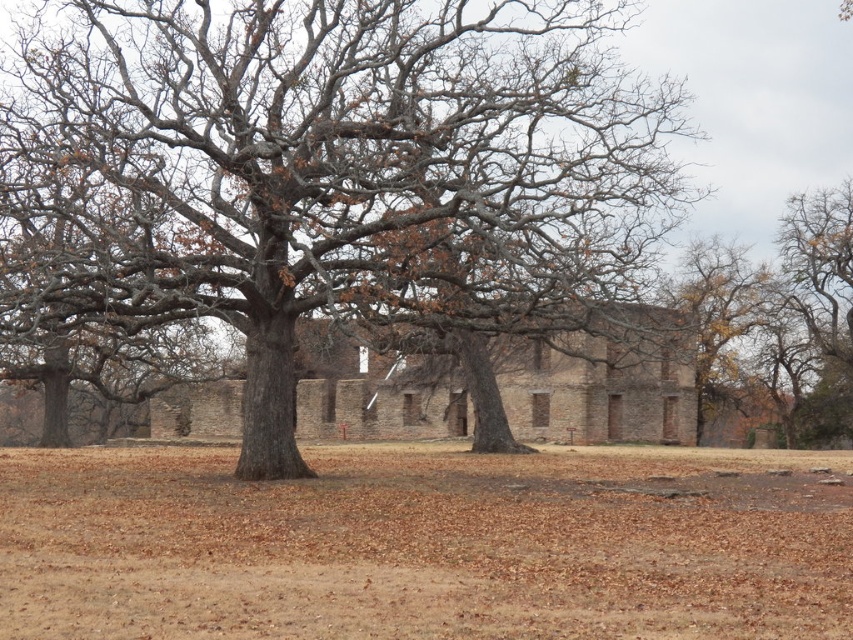
Question: Among these objects, which one is nearest to the camera?

Choices:
 (A) brown rough bark tree at center
 (B) yellow-green leaves at center

Answer: (A)

Question: Can you confirm if brown dry grass at center is smaller than yellow-green leaves at center?

Choices:
 (A) yes
 (B) no

Answer: (B)

Question: Which object appears closest to the camera in this image?

Choices:
 (A) yellow-green leaves at center
 (B) brown dry grass at center
 (C) brown rough bark tree at center

Answer: (B)

Question: Can you confirm if brown rough bark tree at center is bigger than brown dry grass at center?

Choices:
 (A) no
 (B) yes

Answer: (B)

Question: Can you confirm if brown rough bark tree at center is wider than brown dry grass at center?

Choices:
 (A) no
 (B) yes

Answer: (A)

Question: Which point is farther from the camera taking this photo?

Choices:
 (A) (294, 141)
 (B) (312, 522)
 (C) (705, 240)

Answer: (C)